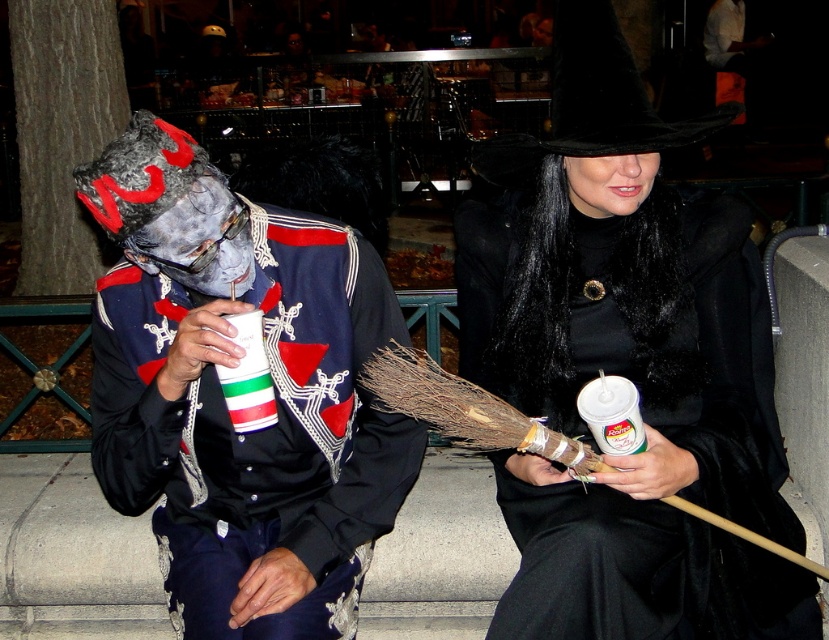
Question: Can you confirm if black fur coat at center is positioned above matte black costume at center?

Choices:
 (A) no
 (B) yes

Answer: (B)

Question: Can you confirm if black fur coat at center is positioned above matte black costume at center?

Choices:
 (A) no
 (B) yes

Answer: (B)

Question: Can you confirm if black fur coat at center is positioned above matte black costume at center?

Choices:
 (A) no
 (B) yes

Answer: (B)

Question: Which object appears farthest from the camera in this image?

Choices:
 (A) matte black costume at center
 (B) black fur coat at center

Answer: (B)

Question: Which of the following is the farthest from the observer?

Choices:
 (A) (565, 216)
 (B) (95, 168)

Answer: (A)